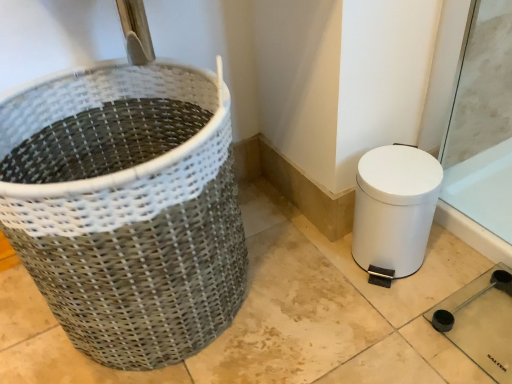
I want to click on vacant region in front of white matte toilet bowl at lower right, so click(x=396, y=324).